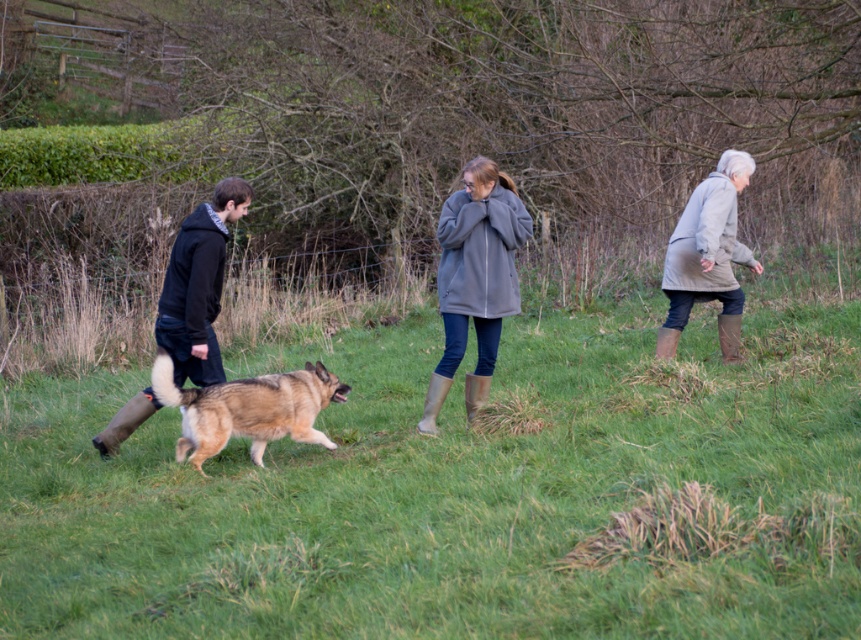
Between point (717, 500) and point (323, 376), which one is positioned behind?

Point (323, 376)

Is green grassy field at center taller than brown fur dog at center?

Correct, green grassy field at center is much taller as brown fur dog at center.

Does point (98, 428) lie in front of point (314, 435)?

No, it is behind (314, 435).

Image resolution: width=861 pixels, height=640 pixels. I want to click on green grassy field at center, so click(x=457, y=486).

Between brown fur dog at center and light gray coat at right, which one has more height?

light gray coat at right is taller.

Can you confirm if brown fur dog at center is positioned to the right of light gray coat at right?

Incorrect, brown fur dog at center is not on the right side of light gray coat at right.

Between point (310, 404) and point (671, 259), which one is positioned behind?

The point (671, 259) is more distant.

At what (x,y) coordinates should I click in order to perform the action: click on brown fur dog at center. Please return your answer as a coordinate pair (x, y). The width and height of the screenshot is (861, 640). Looking at the image, I should click on (248, 408).

Does dark brown leather boots at left come behind light gray coat at right?

That is False.

Is point (129, 406) closer to viewer compared to point (716, 298)?

Yes, it is in front of point (716, 298).

Between point (194, 246) and point (729, 348), which one is positioned in front?

Point (194, 246)

Identify the location of dark brown leather boots at left. [197, 285].